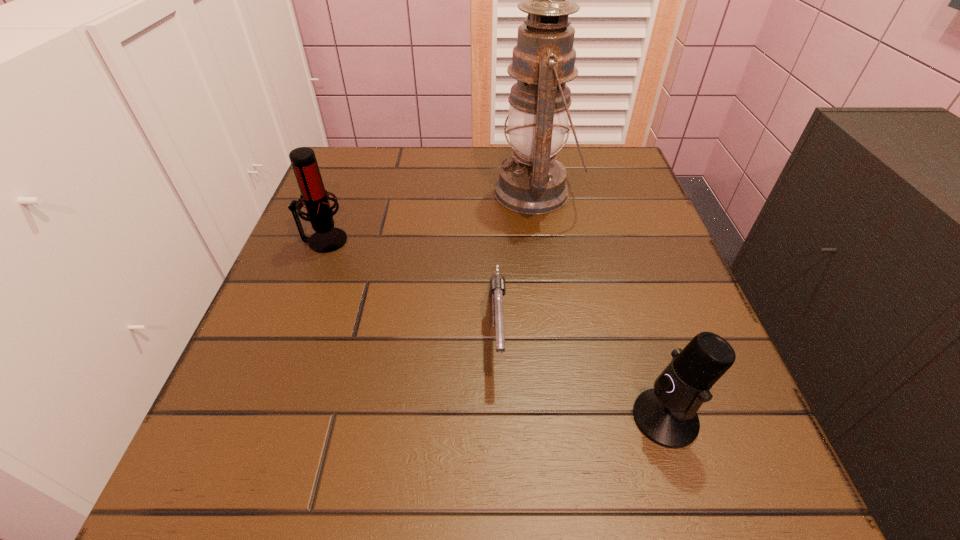
This screenshot has width=960, height=540. What are the coordinates of `free location located 0.370m on the stand of the third tallest object` in the screenshot? It's located at (372, 418).

You are a GUI agent. You are given a task and a screenshot of the screen. Output one action in this format:
    pyautogui.click(x=<x>, y=<y>)
    Task: Click on the vacant space situated on the stand of the third tallest object
    
    Given the screenshot: What is the action you would take?
    pyautogui.click(x=470, y=418)

At what (x,y) coordinates should I click in order to perform the action: click on vacant space located on the stand of the third tallest object. Please return your answer as a coordinate pair (x, y). The image size is (960, 540). Looking at the image, I should click on (499, 418).

Where is `free point located 0.090m aiming along the barrel of the shortest object`? This screenshot has width=960, height=540. free point located 0.090m aiming along the barrel of the shortest object is located at coordinates (501, 440).

Where is `object that is at the far edge`? This screenshot has height=540, width=960. object that is at the far edge is located at coordinates (533, 182).

This screenshot has width=960, height=540. I want to click on object at the near edge, so click(x=667, y=415).

Identify the location of object located at the left edge. (326, 238).

Image resolution: width=960 pixels, height=540 pixels. What are the coordinates of `oil lamp that is at the right edge` in the screenshot? It's located at (533, 182).

I want to click on microphone that is at the right edge, so click(x=667, y=415).

Locate an element on the screen. The width and height of the screenshot is (960, 540). object present at the far right corner is located at coordinates (533, 182).